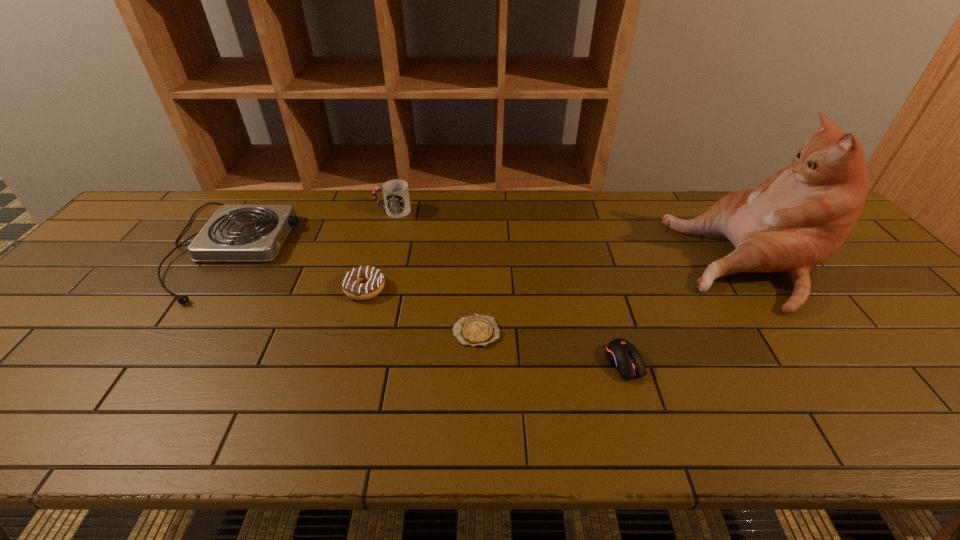
Where is `vacant space located on the face of the rightmost object`? The height and width of the screenshot is (540, 960). vacant space located on the face of the rightmost object is located at coordinates (638, 263).

Image resolution: width=960 pixels, height=540 pixels. Identify the location of free location located on the face of the rightmost object. (603, 263).

At what (x,y) coordinates should I click in order to perform the action: click on vacant space situated on the handle side of the cup. Please return your answer as a coordinate pair (x, y). Image resolution: width=960 pixels, height=540 pixels. Looking at the image, I should click on (255, 211).

Find the location of a particular element. vacant space situated on the handle side of the cup is located at coordinates pyautogui.click(x=342, y=211).

At what (x,y) coordinates should I click in order to perform the action: click on vacant space positioned 0.310m on the handle side of the cup. Please return your answer as a coordinate pair (x, y). Image resolution: width=960 pixels, height=540 pixels. Looking at the image, I should click on (280, 211).

I want to click on vacant point located 0.340m with a retractable cable on the side of the third tallest object, so click(408, 248).

Where is `vacant region located 0.330m on the front of the doughnut`? Image resolution: width=960 pixels, height=540 pixels. vacant region located 0.330m on the front of the doughnut is located at coordinates (327, 422).

Find the location of a particular element. vacant space located on the back of the second object from right to left is located at coordinates (597, 270).

What are the coordinates of `blank space located 0.350m on the left of the shortest object` in the screenshot? It's located at (304, 332).

Find the location of a particular element. The image size is (960, 540). cat that is at the far edge is located at coordinates (797, 218).